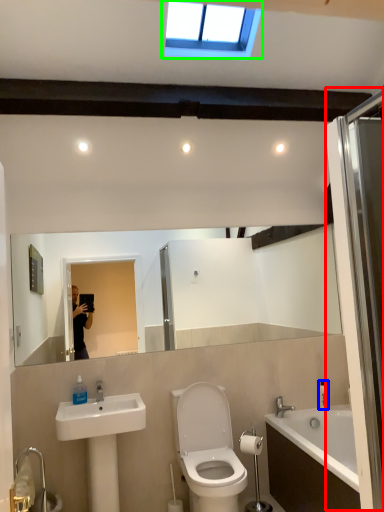
Question: Which object is the closest to the screen door (highlighted by a red box)? Choose among these: toiletry (highlighted by a blue box) or window (highlighted by a green box).

Choices:
 (A) toiletry
 (B) window

Answer: (B)